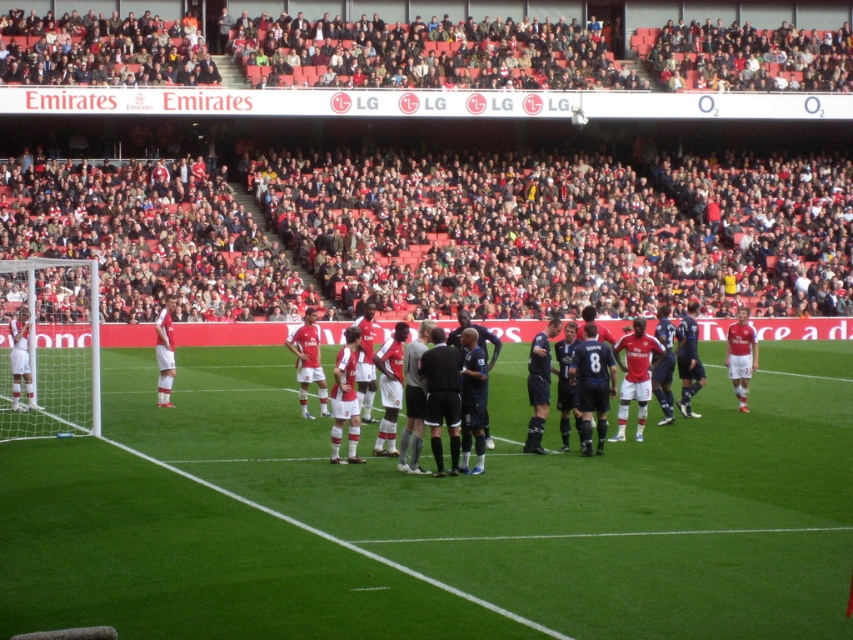
In the scene shown: Is green artificial turf at center positioned behind dark blue jersey at center?

That is False.

Does point (196, 570) lie behind point (685, 413)?

No, (196, 570) is closer to viewer.

This screenshot has height=640, width=853. What are the coordinates of `green artificial turf at center` in the screenshot? It's located at (558, 497).

Is point (612, 576) closer to viewer compared to point (453, 401)?

Yes.

The height and width of the screenshot is (640, 853). I want to click on green artificial turf at center, so 558,497.

Which is more to the left, black smooth shirt at center or black smooth referee at center?

From the viewer's perspective, black smooth shirt at center appears more on the left side.

Does black smooth shirt at center appear under black smooth referee at center?

Indeed, black smooth shirt at center is positioned under black smooth referee at center.

Locate an element on the screen. black smooth shirt at center is located at coordinates (442, 397).

At what (x,y) coordinates should I click in order to perform the action: click on black smooth shirt at center. Please return your answer as a coordinate pair (x, y). The height and width of the screenshot is (640, 853). Looking at the image, I should click on (442, 397).